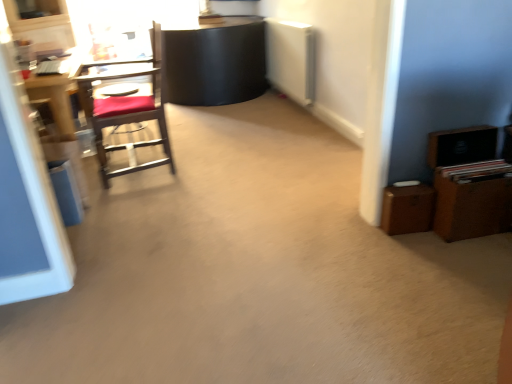
Locate an element on the screen. wooden desk at left is located at coordinates (57, 95).

In order to face brown wooden dresser at right, should I rotate leftwards or rightwards?

To align with it, rotate right about 26.995°.

Locate an element on the screen. This screenshot has height=384, width=512. wooden chair with red cushion at left is located at coordinates (127, 107).

Where is `wooden desk at left`? The width and height of the screenshot is (512, 384). wooden desk at left is located at coordinates (57, 95).

Is wooden desk at left positioned with its back to brown wooden dresser at right?

No.

Considering the sizes of objects wooden desk at left and brown wooden dresser at right in the image provided, who is shorter, wooden desk at left or brown wooden dresser at right?

Standing shorter between the two is brown wooden dresser at right.

Does wooden desk at left have a greater width compared to brown wooden dresser at right?

Indeed, wooden desk at left has a greater width compared to brown wooden dresser at right.

Does wooden desk at left appear on the left side of brown wooden dresser at right?

Indeed, wooden desk at left is positioned on the left side of brown wooden dresser at right.

Considering the sizes of objects wooden chair with red cushion at left and wooden desk at left in the image provided, who is shorter, wooden chair with red cushion at left or wooden desk at left?

With less height is wooden desk at left.

Identify the location of desk that appears on the left of wooden chair with red cushion at left. The width and height of the screenshot is (512, 384). (57, 95).

Is wooden chair with red cushion at left wider than wooden desk at left?

Indeed, wooden chair with red cushion at left has a greater width compared to wooden desk at left.

Is wooden desk at left inside or outside of wooden chair with red cushion at left?

wooden desk at left is outside wooden chair with red cushion at left.

From the picture: From a real-world perspective, is wooden desk at left above or below wooden chair with red cushion at left?

From a real-world perspective, wooden desk at left is physically below wooden chair with red cushion at left.

The image size is (512, 384). What are the coordinates of `chair on the right of wooden desk at left` in the screenshot? It's located at click(127, 107).

Is the surface of wooden desk at left in direct contact with wooden chair with red cushion at left?

They are not placed beside each other.

From a real-world perspective, which is physically above, brown wooden dresser at right or wooden desk at left?

wooden desk at left.

Can wooden desk at left be found inside brown wooden dresser at right?

No.

Which is more to the left, brown wooden dresser at right or wooden desk at left?

From the viewer's perspective, wooden desk at left appears more on the left side.

Which object is thinner, brown wooden dresser at right or wooden desk at left?

Thinner between the two is brown wooden dresser at right.

In the image, is brown wooden dresser at right positioned in front of or behind wooden chair with red cushion at left?

Visually, brown wooden dresser at right is located in front of wooden chair with red cushion at left.

Which is more to the left, brown wooden dresser at right or wooden chair with red cushion at left?

Positioned to the left is wooden chair with red cushion at left.

Looking at this image, how much distance is there between brown wooden dresser at right and wooden chair with red cushion at left?

brown wooden dresser at right is 6.24 feet away from wooden chair with red cushion at left.

Is brown wooden dresser at right positioned with its back to wooden chair with red cushion at left?

brown wooden dresser at right is not turned away from wooden chair with red cushion at left.

Between wooden chair with red cushion at left and brown wooden dresser at right, which one has smaller width?

Thinner between the two is brown wooden dresser at right.

From a real-world perspective, who is located lower, wooden chair with red cushion at left or brown wooden dresser at right?

From a 3D spatial view, brown wooden dresser at right is below.

Is point (102, 175) closer or farther from the camera than point (489, 183)?

Point (102, 175) appears to be farther away from the viewer than point (489, 183).

Image resolution: width=512 pixels, height=384 pixels. What are the coordinates of `desk that is above the brown wooden dresser at right (from the image's perspective)` in the screenshot? It's located at (57, 95).

Where is `desk that is behind the wooden chair with red cushion at left`? This screenshot has height=384, width=512. desk that is behind the wooden chair with red cushion at left is located at coordinates pos(57,95).

From the image, which object appears to be nearer to wooden chair with red cushion at left, wooden desk at left or brown wooden dresser at right?

Based on the image, wooden desk at left appears to be nearer to wooden chair with red cushion at left.

When comparing their distances from wooden desk at left, does brown wooden dresser at right or wooden chair with red cushion at left seem further?

brown wooden dresser at right is positioned further to the anchor wooden desk at left.

Based on their spatial positions, is wooden chair with red cushion at left or brown wooden dresser at right closer to wooden desk at left?

wooden chair with red cushion at left is positioned closer to the anchor wooden desk at left.

From the image, which object appears to be farther from brown wooden dresser at right, wooden desk at left or wooden chair with red cushion at left?

The object further to brown wooden dresser at right is wooden desk at left.

Estimate the real-world distances between objects in this image. Which object is closer to brown wooden dresser at right, wooden chair with red cushion at left or wooden desk at left?

The object closer to brown wooden dresser at right is wooden chair with red cushion at left.

Which object lies further to the anchor point wooden chair with red cushion at left, brown wooden dresser at right or wooden desk at left?

brown wooden dresser at right is further to wooden chair with red cushion at left.

Locate an element on the screen. The width and height of the screenshot is (512, 384). chair between wooden desk at left and brown wooden dresser at right is located at coordinates (127, 107).